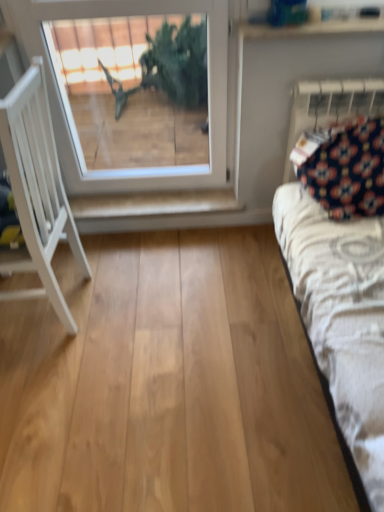
Identify the location of free spot in front of white wood chair at left. (56, 387).